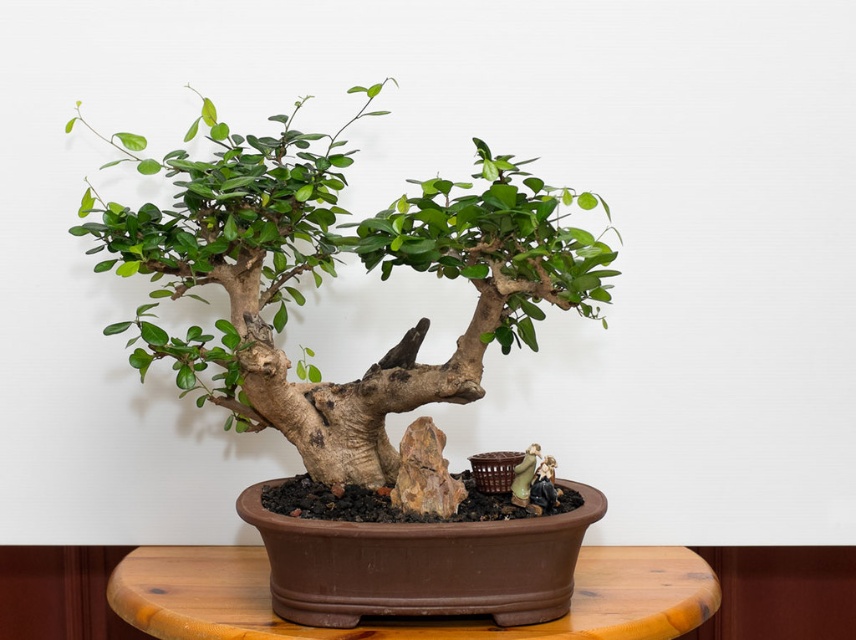
Question: Does green matte bonsai tree at center appear over brown wooden table at center?

Choices:
 (A) yes
 (B) no

Answer: (A)

Question: Among these objects, which one is nearest to the camera?

Choices:
 (A) green matte bonsai tree at center
 (B) brown wooden table at center

Answer: (A)

Question: Which object is closer to the camera taking this photo?

Choices:
 (A) brown wooden table at center
 (B) green matte bonsai tree at center

Answer: (B)

Question: Does green matte bonsai tree at center lie behind brown wooden table at center?

Choices:
 (A) no
 (B) yes

Answer: (A)

Question: Is green matte bonsai tree at center wider than brown wooden table at center?

Choices:
 (A) no
 (B) yes

Answer: (A)